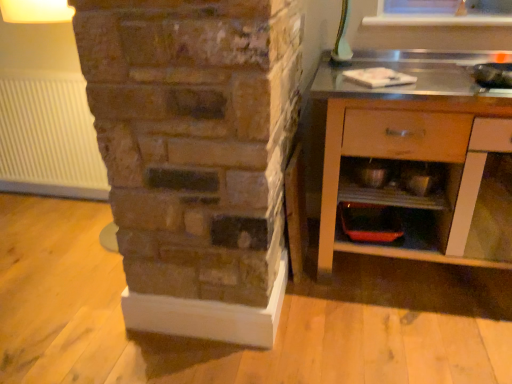
Question: Is matte orange tray at lower center, the 1th shelf ordered from the bottom, positioned with its back to metallic silver bowls at lower right, placed as the 1th shelf when sorted from top to bottom?

Choices:
 (A) yes
 (B) no

Answer: (B)

Question: Is matte orange tray at lower center, the 2th shelf positioned from the top, positioned in front of metallic silver bowls at lower right, placed as the 1th shelf when sorted from top to bottom?

Choices:
 (A) no
 (B) yes

Answer: (A)

Question: From the image's perspective, is matte orange tray at lower center, the 1th shelf ordered from the bottom, beneath metallic silver bowls at lower right, placed as the 1th shelf when sorted from top to bottom?

Choices:
 (A) no
 (B) yes

Answer: (B)

Question: Is matte orange tray at lower center, the 2th shelf positioned from the top, at the left side of metallic silver bowls at lower right, placed as the 1th shelf when sorted from top to bottom?

Choices:
 (A) no
 (B) yes

Answer: (B)

Question: Is matte orange tray at lower center, the 1th shelf ordered from the bottom, shorter than metallic silver bowls at lower right, placed as the 1th shelf when sorted from top to bottom?

Choices:
 (A) yes
 (B) no

Answer: (A)

Question: Considering the relative sizes of matte orange tray at lower center, the 1th shelf ordered from the bottom, and metallic silver bowls at lower right, placed as the 1th shelf when sorted from top to bottom, in the image provided, is matte orange tray at lower center, the 1th shelf ordered from the bottom, smaller than metallic silver bowls at lower right, placed as the 1th shelf when sorted from top to bottom,?

Choices:
 (A) yes
 (B) no

Answer: (A)

Question: From the image's perspective, would you say wooden cabinet at right is positioned over white ribbed radiator at left?

Choices:
 (A) no
 (B) yes

Answer: (A)

Question: From a real-world perspective, is wooden cabinet at right beneath white ribbed radiator at left?

Choices:
 (A) yes
 (B) no

Answer: (B)

Question: Is wooden cabinet at right looking in the opposite direction of white ribbed radiator at left?

Choices:
 (A) no
 (B) yes

Answer: (A)

Question: Is wooden cabinet at right taller than white ribbed radiator at left?

Choices:
 (A) yes
 (B) no

Answer: (A)

Question: Considering the relative positions of wooden cabinet at right and white ribbed radiator at left in the image provided, is wooden cabinet at right to the left of white ribbed radiator at left from the viewer's perspective?

Choices:
 (A) yes
 (B) no

Answer: (B)

Question: Is wooden cabinet at right to the right of white ribbed radiator at left from the viewer's perspective?

Choices:
 (A) yes
 (B) no

Answer: (A)

Question: From the image's perspective, is metallic silver bowls at lower right, placed as the 1th shelf when sorted from top to bottom, located beneath white ribbed radiator at left?

Choices:
 (A) yes
 (B) no

Answer: (A)